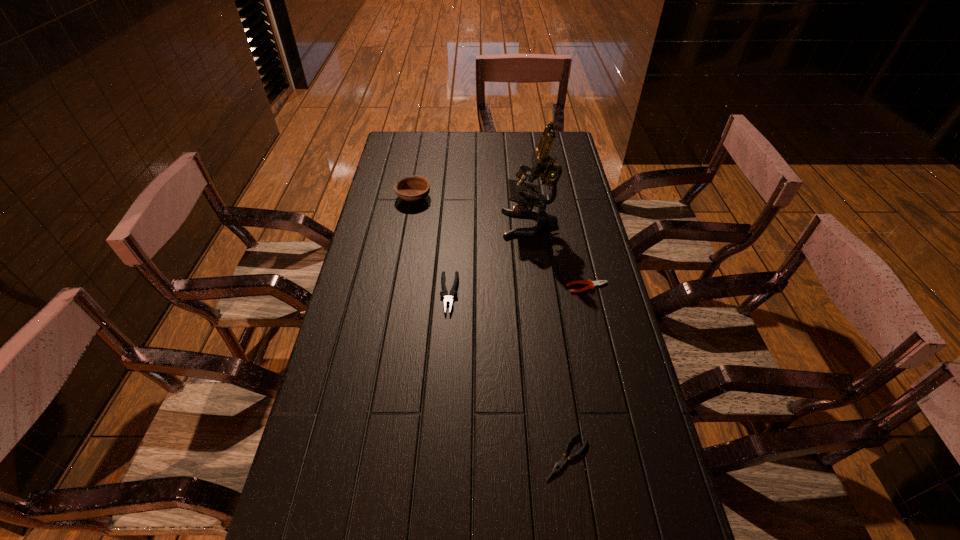
I want to click on vacant area situated 0.100m at the eyepieces of the microscope, so click(474, 224).

This screenshot has height=540, width=960. In order to click on vacant point located at the eyepieces of the microscope in this screenshot , I will do `click(445, 224)`.

The image size is (960, 540). I want to click on free space located on the front of the farthest object, so click(401, 267).

This screenshot has height=540, width=960. Find the location of `vacant space located 0.370m at the gripping part of the fourth object from right to left`. vacant space located 0.370m at the gripping part of the fourth object from right to left is located at coordinates (440, 440).

Where is `free space located on the back of the nearest object`? free space located on the back of the nearest object is located at coordinates (550, 330).

This screenshot has height=540, width=960. In order to click on free space located on the front of the rightmost pliers in this screenshot , I will do `click(611, 388)`.

Locate an element on the screen. object that is at the left edge is located at coordinates (411, 188).

Identify the location of microscope that is at the right edge. (543, 164).

The width and height of the screenshot is (960, 540). In order to click on vacant region at the far edge of the desktop in this screenshot , I will do `click(448, 132)`.

Where is `free space at the left edge of the desktop`? free space at the left edge of the desktop is located at coordinates (350, 286).